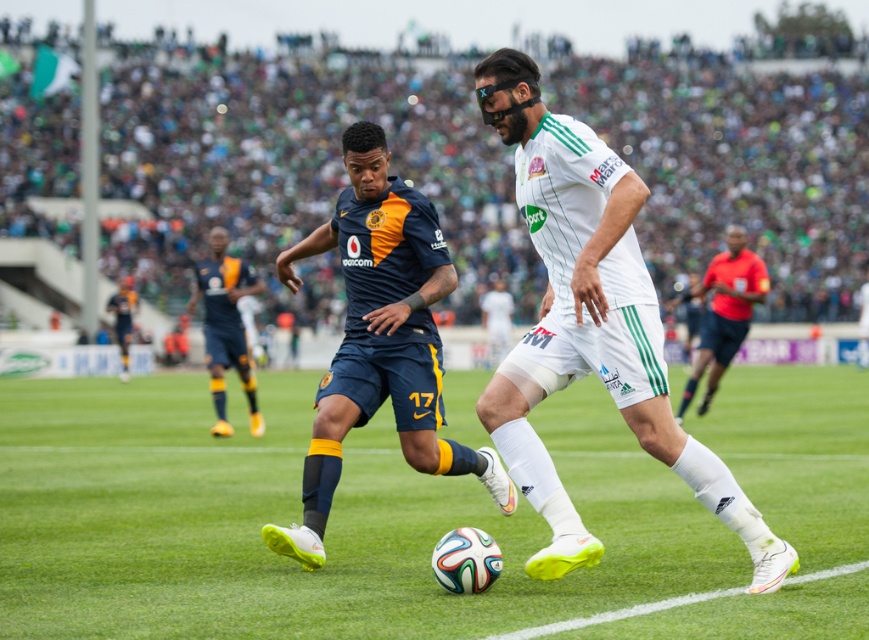
Question: Does matte blue shorts at center appear under red shirt at right?

Choices:
 (A) yes
 (B) no

Answer: (A)

Question: Which point is farther to the camera?

Choices:
 (A) matte blue shorts at center
 (B) dark blue jersey at center
 (C) white matte soccer player at center

Answer: (B)

Question: Does matte blue shorts at center lie in front of dark blue jersey at center?

Choices:
 (A) no
 (B) yes

Answer: (B)

Question: Which of the following is the closest to the observer?

Choices:
 (A) white matte soccer player at center
 (B) green grass football field at center
 (C) red shirt at right

Answer: (A)

Question: Does green grass football field at center appear over dark blue jersey at center?

Choices:
 (A) yes
 (B) no

Answer: (B)

Question: Which object is positioned farthest from the red shirt at right?

Choices:
 (A) dark blue jersey at center
 (B) green grass football field at center
 (C) matte blue shorts at center
 (D) white matte soccer player at center

Answer: (D)